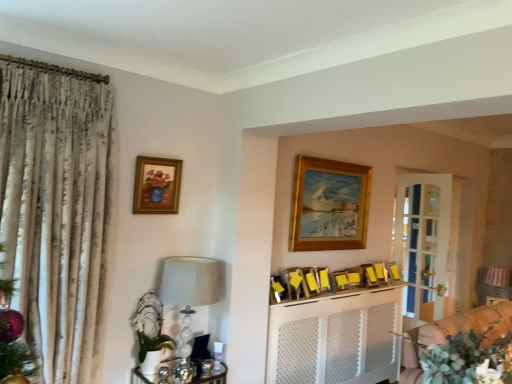
Question: From a real-world perspective, is wooden picture frame at upper center, the 2th picture frame positioned from the right, physically located above or below striped fabric cushion at right, positioned as the 3th furniture in front-to-back order?

Choices:
 (A) below
 (B) above

Answer: (B)

Question: Considering the relative positions of wooden picture frame at upper center, the eighth picture frame when ordered from left to right, and striped fabric cushion at right, which is the third furniture in left-to-right order, in the image provided, is wooden picture frame at upper center, the eighth picture frame when ordered from left to right, to the left or to the right of striped fabric cushion at right, which is the third furniture in left-to-right order,?

Choices:
 (A) right
 (B) left

Answer: (B)

Question: Which object is the closest to the gold wooden picture frame at upper center, which is the fifth picture frame from left to right?

Choices:
 (A) wooden picture frame at center, marked as the seventh picture frame in a left-to-right arrangement
 (B) matte glass lamp at left
 (C) wooden picture frame at center, the sixth picture frame from the right
 (D) white textured cabinet at center, placed as the 2th furniture when sorted from right to left
 (E) striped fabric cushion at right, which is the first furniture in right-to-left order

Answer: (C)

Question: Considering the real-world distances, which object is farthest from the wooden frame with floral painting at upper left, the 1th picture frame positioned from the left?

Choices:
 (A) white textured cabinet at center, positioned as the 3th furniture in back-to-front order
 (B) wooden picture frame at upper center, the 2th picture frame positioned from the right
 (C) gold wooden picture frame at upper center, which is the fifth picture frame from left to right
 (D) striped fabric cushion at right, positioned as the 3th furniture in front-to-back order
 (E) shiny metallic tray at lower center, placed as the second furniture when sorted from front to back

Answer: (D)